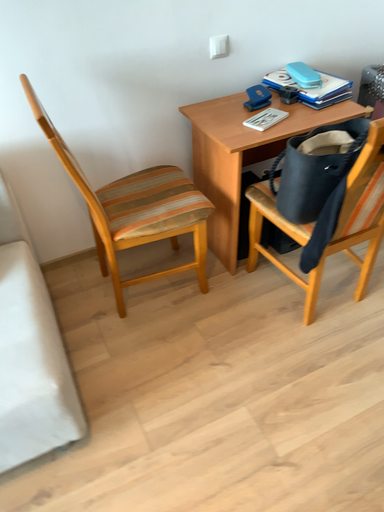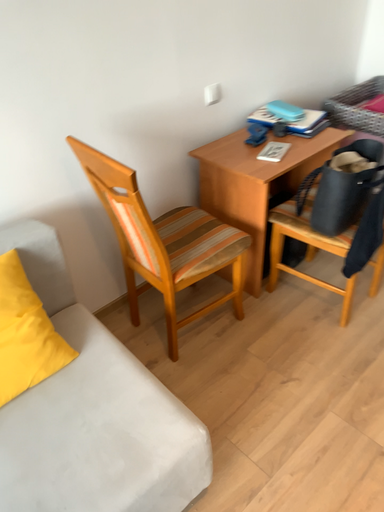
Question: Which way did the camera rotate in the video?

Choices:
 (A) rotated downward
 (B) rotated upward

Answer: (B)